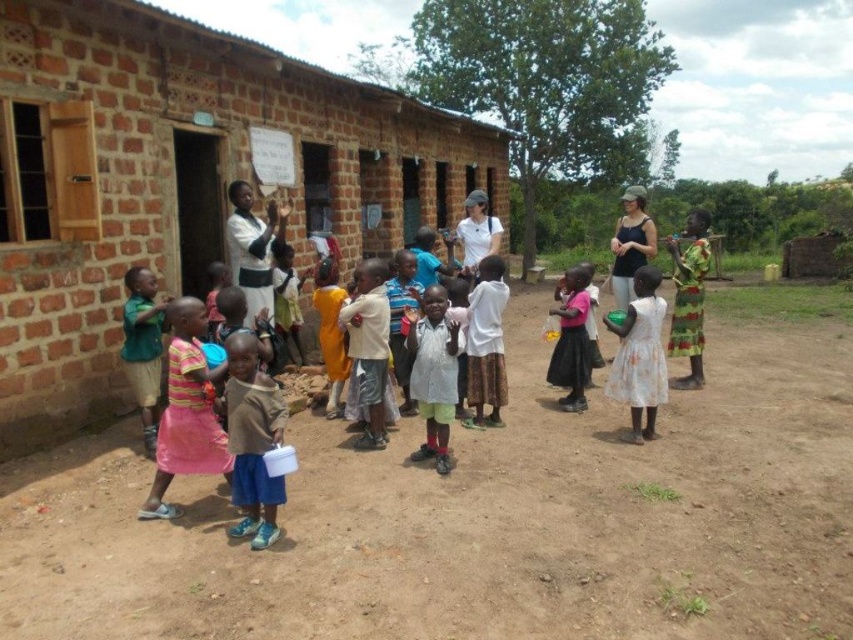
Who is lower down, white matte shirt at center or green matte shirt at left?

green matte shirt at left is below.

Which is more to the left, white matte shirt at center or green matte shirt at left?

Positioned to the left is green matte shirt at left.

Find the location of a particular element. white matte shirt at center is located at coordinates (486, 342).

Is brown dirt field at center to the left of pink fabric dress at center from the viewer's perspective?

Yes, brown dirt field at center is to the left of pink fabric dress at center.

Does brown dirt field at center have a lesser width compared to pink fabric dress at center?

Correct, brown dirt field at center's width is less than pink fabric dress at center's.

Who is more distant from viewer, (380,492) or (589,300)?

The point (589,300) is behind.

The image size is (853, 640). In order to click on brown dirt field at center in this screenshot , I will do `click(480, 520)`.

What do you see at coordinates (640, 355) in the screenshot? The image size is (853, 640). I see `white floral dress at center` at bounding box center [640, 355].

Who is more forward, (647, 300) or (576, 364)?

Point (647, 300) is in front.

The width and height of the screenshot is (853, 640). I want to click on white floral dress at center, so click(640, 355).